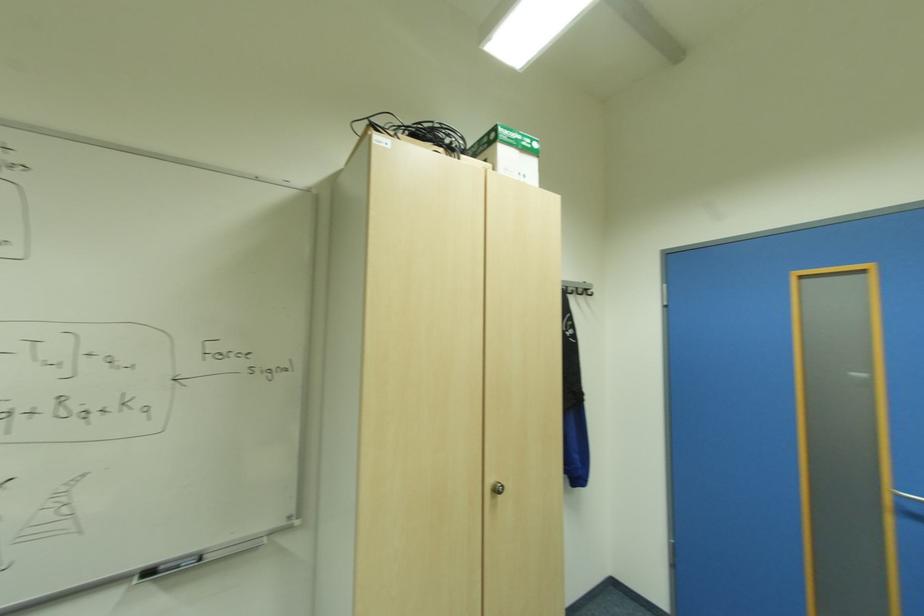
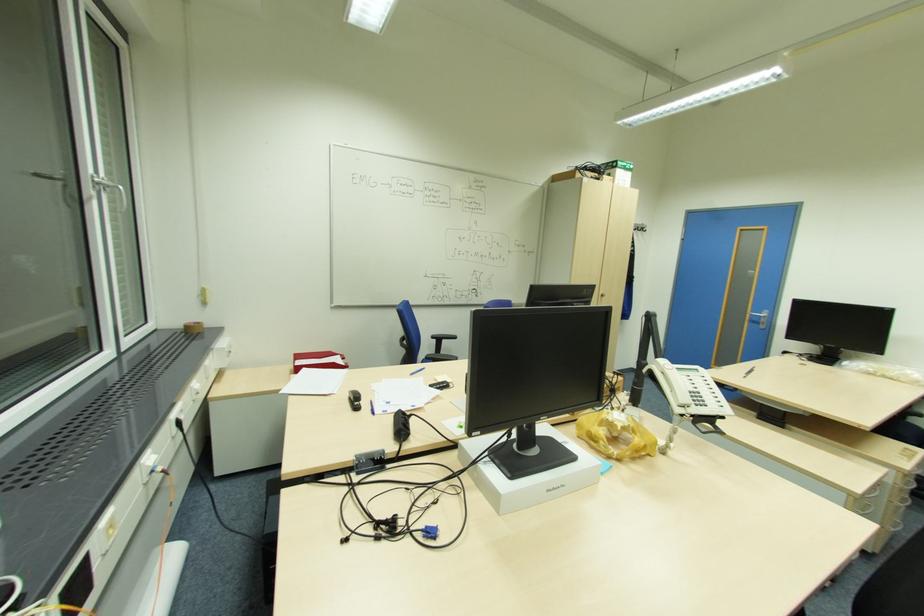
Which direction would the cameraman need to move to produce the second image?

The cameraman moved toward left, backward.